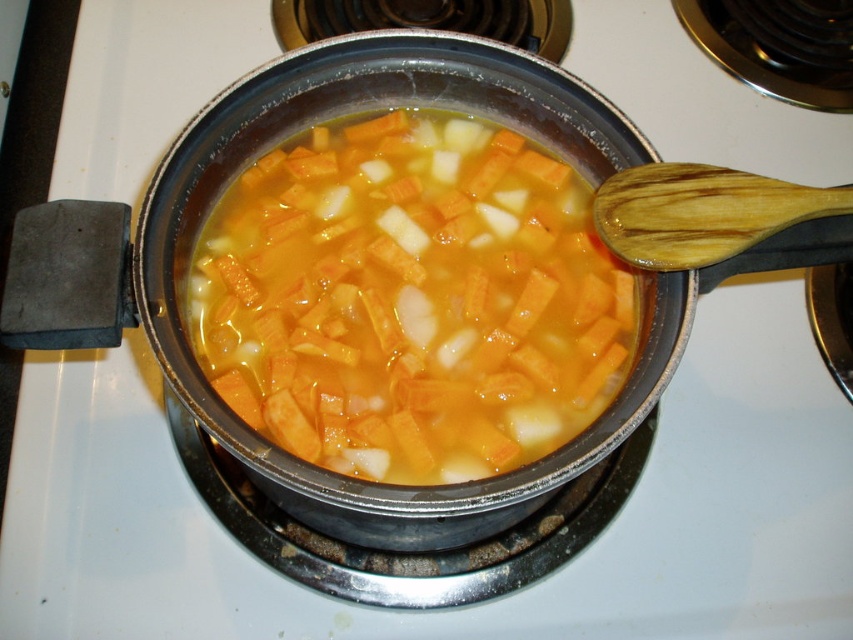
Between point (331, 440) and point (750, 232), which one is positioned behind?

The point (331, 440) is behind.

Image resolution: width=853 pixels, height=640 pixels. What do you see at coordinates (410, 300) in the screenshot? I see `orange matte/soft pumpkin soup at center` at bounding box center [410, 300].

Which is behind, point (575, 422) or point (717, 179)?

Positioned behind is point (575, 422).

You are a GUI agent. You are given a task and a screenshot of the screen. Output one action in this format:
    pyautogui.click(x=<x>, y=<y>)
    Task: Click on the orange matte/soft pumpkin soup at center
    
    Given the screenshot: What is the action you would take?
    pyautogui.click(x=410, y=300)